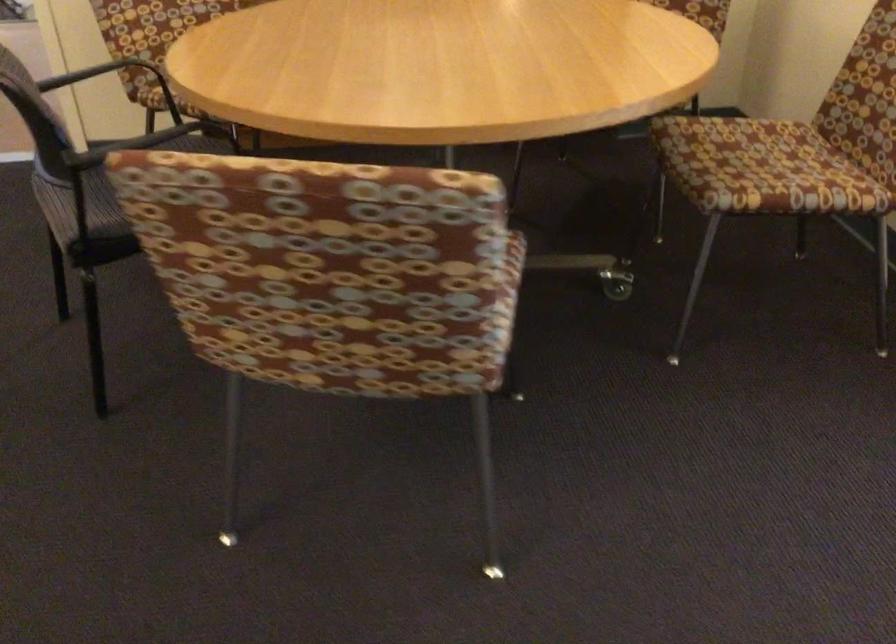
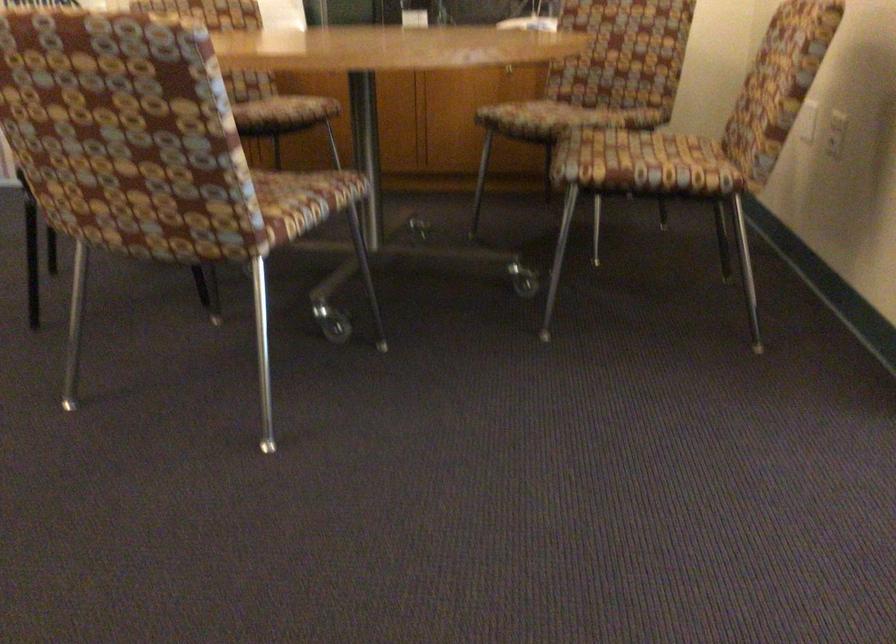
Locate, in the second image, the point that corresponds to (791,178) in the first image.

(643, 164)